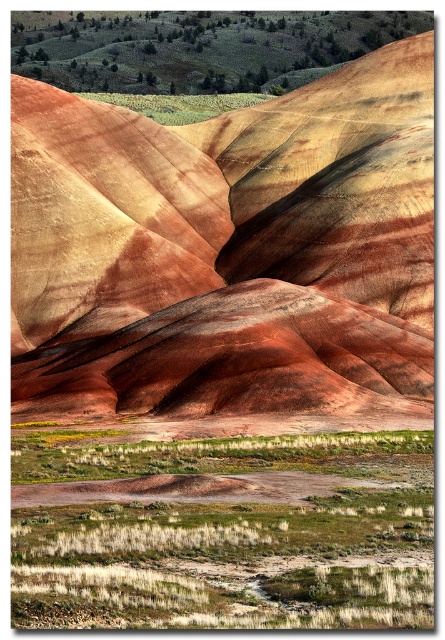
Who is higher up, multicolored sedimentary rock at center or green grass at lower center?

multicolored sedimentary rock at center is higher up.

Does point (318, 285) come closer to viewer compared to point (56, 616)?

That is False.

Between point (191, 387) and point (102, 536), which one is positioned behind?

Positioned behind is point (191, 387).

Identify the location of multicolored sedimentary rock at center. (227, 250).